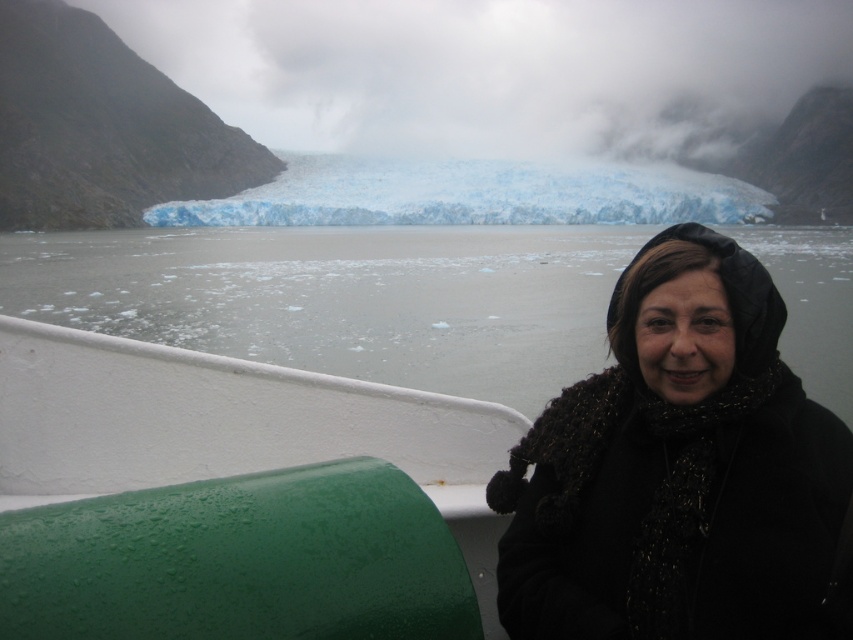
Question: Is black knitted scarf at center bigger than green rubber tube at lower left?

Choices:
 (A) no
 (B) yes

Answer: (A)

Question: Can you confirm if gray ice at lower center is wider than blue ice glacier at center?

Choices:
 (A) yes
 (B) no

Answer: (A)

Question: Which point is farther to the camera?

Choices:
 (A) (521, 602)
 (B) (234, 200)
 (C) (292, 413)

Answer: (B)

Question: Which object appears closest to the camera in this image?

Choices:
 (A) blue ice glacier at center
 (B) gray ice at lower center
 (C) black knitted scarf at center
 (D) green rubber tube at lower left

Answer: (C)

Question: Where is gray ice at lower center located in relation to blue ice glacier at center in the image?

Choices:
 (A) left
 (B) right

Answer: (B)

Question: Among these objects, which one is farthest from the camera?

Choices:
 (A) blue ice glacier at center
 (B) gray ice at lower center
 (C) black knitted scarf at center
 (D) green rubber tube at lower left

Answer: (A)